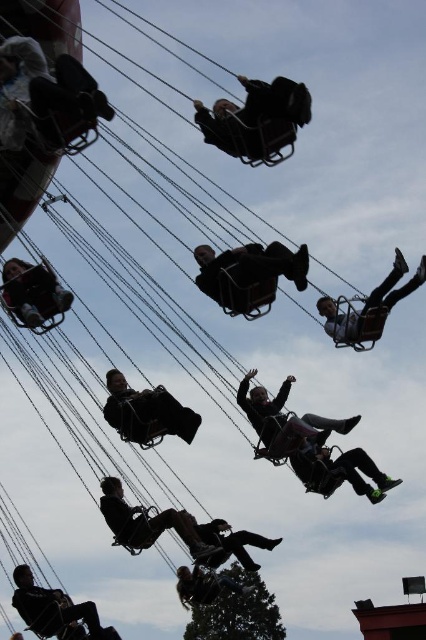
Which is in front, point (367, 308) or point (31, 273)?

Point (31, 273) is in front.

Image resolution: width=426 pixels, height=640 pixels. What are the coordinates of `matte black swing at center` in the screenshot? It's located at (370, 307).

Who is more forward, (222, 292) or (331, 321)?

Point (222, 292)

You are a GUI agent. You are given a task and a screenshot of the screen. Output one action in this format:
    pyautogui.click(x=<x>, y=<y>)
    Task: Click on the black matte swing at center
    
    Given the screenshot: What is the action you would take?
    coord(250,268)

Does matte black helmet at center come in front of matte black person at center?

Yes, matte black helmet at center is in front of matte black person at center.

You are a GUI agent. You are given a task and a screenshot of the screen. Output one action in this format:
    pyautogui.click(x=<x>, y=<y>)
    Task: Click on the matte black helmet at center
    Image resolution: width=426 pixels, height=640 pixels.
    Given the screenshot: What is the action you would take?
    pyautogui.click(x=256, y=120)